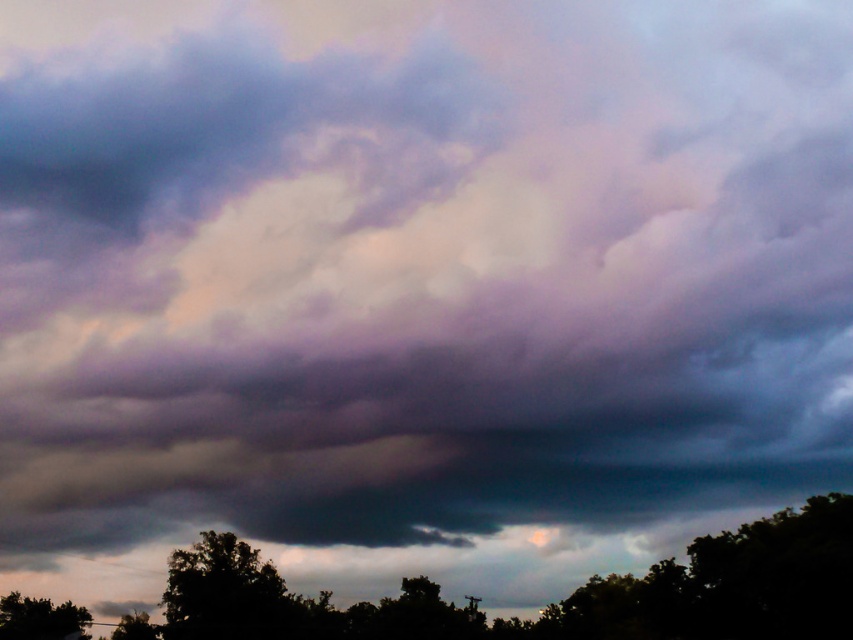
You are a bird flying at an altitude of 30 feet. You want to land on a tree. Which tree can you reach without descending further? The silhouette leafy tree at lower center and the green matte tree at lower left are 35.29 feet apart from each other. The bird is currently at an altitude of 30 feet. Which tree can the bird land on without descending further?

The bird can land on either the silhouette leafy tree at lower center or the green matte tree at lower left since both are within the bird s current altitude of 30 feet. However, the exact height of the trees isn t specified, so assuming they are below or at 30 feet, the bird can land on either.

You are an artist trying to paint the scene. You need to know the relative positions of the green leafy tree at lower center and the green matte tree at lower left. Which tree is more to the left?

The green leafy tree at lower center is positioned on the right side of green matte tree at lower left, so the green matte tree at lower left is more to the left.